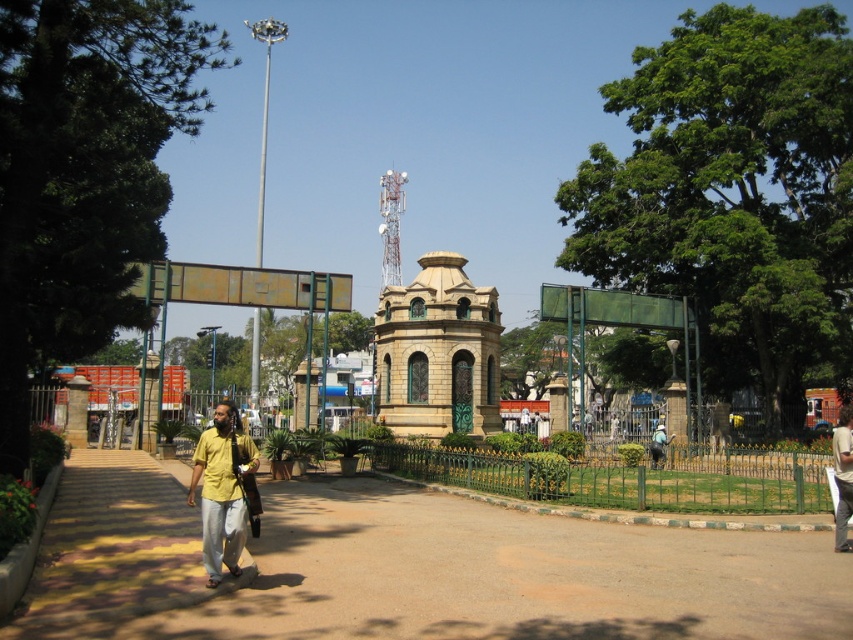
Is brown concrete pavement at center above yellow cotton shirt at lower left?

Incorrect, brown concrete pavement at center is not positioned above yellow cotton shirt at lower left.

Does brown concrete pavement at center appear under yellow cotton shirt at lower left?

Yes.

Who is more forward, (788, 532) or (235, 544)?

Positioned in front is point (235, 544).

The width and height of the screenshot is (853, 640). I want to click on brown concrete pavement at center, so click(457, 573).

Is yellow cotton shirt at lower left to the left of yellow shirt at center from the viewer's perspective?

Yes, yellow cotton shirt at lower left is to the left of yellow shirt at center.

Measure the distance between yellow cotton shirt at lower left and yellow shirt at center.

yellow cotton shirt at lower left and yellow shirt at center are 41.67 meters apart from each other.

Is point (241, 497) closer to camera compared to point (840, 442)?

Yes, it is in front of point (840, 442).

The image size is (853, 640). Find the location of `yellow cotton shirt at lower left`. yellow cotton shirt at lower left is located at coordinates (222, 490).

In the scene shown: Can you confirm if brown concrete pavement at center is positioned to the right of yellow shirt at center?

Incorrect, brown concrete pavement at center is not on the right side of yellow shirt at center.

Is point (822, 563) positioned in front of point (846, 440)?

Yes, it is in front of point (846, 440).

This screenshot has height=640, width=853. What are the coordinates of `brown concrete pavement at center` in the screenshot? It's located at (457, 573).